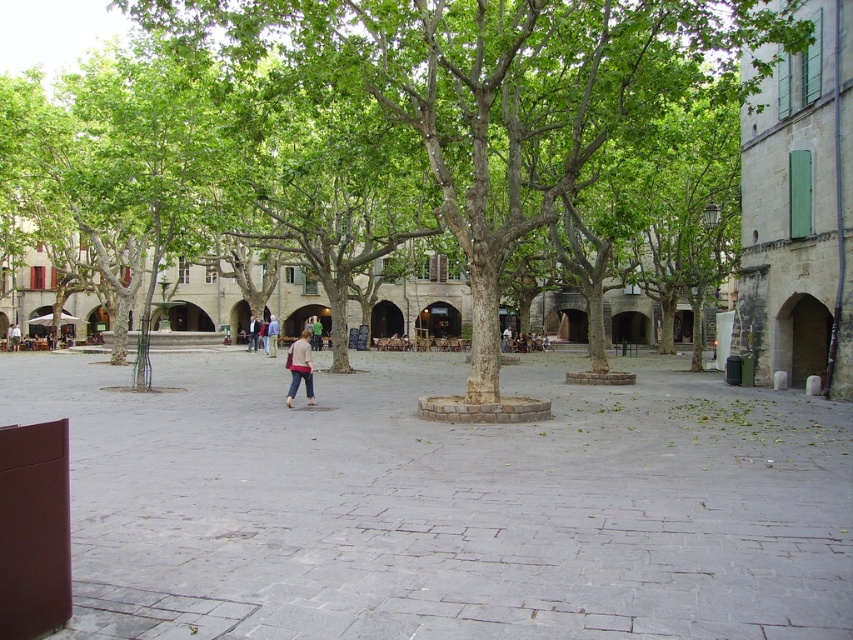
How distant is gray stone courtyard at lower left from pink fabric pants at center?

gray stone courtyard at lower left and pink fabric pants at center are 5.46 meters apart from each other.

Does gray stone courtyard at lower left lie in front of pink fabric pants at center?

Yes, it is in front of pink fabric pants at center.

Measure the distance between point (631, 572) and camera.

Point (631, 572) and camera are 5.43 meters apart.

Locate an element on the screen. The height and width of the screenshot is (640, 853). gray stone courtyard at lower left is located at coordinates (445, 502).

Which is in front, point (294, 364) or point (317, 346)?

Point (294, 364)

Does pink fabric pants at center come behind green fabric jacket at center?

No, it is not.

This screenshot has width=853, height=640. What do you see at coordinates (300, 368) in the screenshot?
I see `pink fabric pants at center` at bounding box center [300, 368].

The width and height of the screenshot is (853, 640). In order to click on pink fabric pants at center in this screenshot , I will do (300, 368).

Who is higher up, denim jacket at center or green fabric jacket at center?

green fabric jacket at center

Image resolution: width=853 pixels, height=640 pixels. What are the coordinates of `denim jacket at center` in the screenshot? It's located at (252, 333).

Which is behind, point (251, 326) or point (318, 321)?

The point (318, 321) is behind.

Find the location of `denim jacket at center`. denim jacket at center is located at coordinates (252, 333).